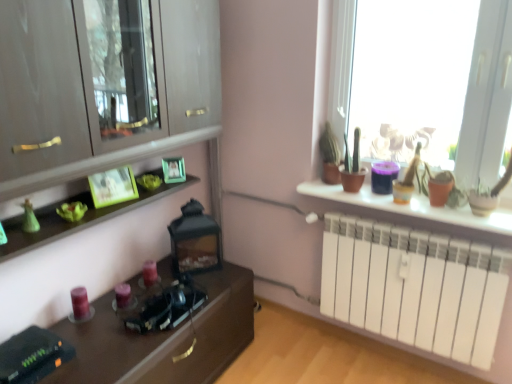
Question: Could matte green picture frame at center, the first picture frame in the back-to-front sequence, be considered to be inside matte white radiator at right?

Choices:
 (A) yes
 (B) no

Answer: (B)

Question: From the image's perspective, is matte white radiator at right located beneath matte green picture frame at center, the first picture frame in the back-to-front sequence?

Choices:
 (A) yes
 (B) no

Answer: (A)

Question: Considering the relative positions of matte white radiator at right and matte green picture frame at center, the first picture frame in the back-to-front sequence, in the image provided, is matte white radiator at right to the left of matte green picture frame at center, the first picture frame in the back-to-front sequence, from the viewer's perspective?

Choices:
 (A) no
 (B) yes

Answer: (A)

Question: From the image's perspective, is matte white radiator at right above matte green picture frame at center, the first picture frame positioned from the right?

Choices:
 (A) yes
 (B) no

Answer: (B)

Question: Is matte white radiator at right at the right side of matte green picture frame at center, the first picture frame in the back-to-front sequence?

Choices:
 (A) yes
 (B) no

Answer: (A)

Question: From their relative heights in the image, would you say matte purple candle at lower left, which is counted as the 1th candle, starting from the right, is taller or shorter than matte purple candle at lower left, which is the second candle from right to left?

Choices:
 (A) tall
 (B) short

Answer: (B)

Question: Considering the positions of matte purple candle at lower left, which is the 2th candle from left to right, and matte purple candle at lower left, which is the first candle from left to right, in the image, is matte purple candle at lower left, which is the 2th candle from left to right, wider or thinner than matte purple candle at lower left, which is the first candle from left to right,?

Choices:
 (A) thin
 (B) wide

Answer: (A)

Question: Is matte purple candle at lower left, which is the 2th candle from left to right, to the left or to the right of matte purple candle at lower left, which is the second candle from right to left, in the image?

Choices:
 (A) right
 (B) left

Answer: (A)

Question: Is matte purple candle at lower left, which is the 2th candle from left to right, in front of or behind matte purple candle at lower left, which is the second candle from right to left, in the image?

Choices:
 (A) front
 (B) behind

Answer: (B)

Question: From the image's perspective, relative to matte purple candle at lower left, which is the second candle from right to left, is green matte picture frame at upper left, acting as the second picture frame starting from the back, above or below?

Choices:
 (A) below
 (B) above

Answer: (B)

Question: Relative to matte purple candle at lower left, which is the first candle from left to right, is green matte picture frame at upper left, acting as the second picture frame starting from the back, in front or behind?

Choices:
 (A) behind
 (B) front

Answer: (B)

Question: From their relative heights in the image, would you say green matte picture frame at upper left, which appears as the first picture frame when viewed from the front, is taller or shorter than matte purple candle at lower left, which is the first candle from left to right?

Choices:
 (A) tall
 (B) short

Answer: (A)

Question: Is green matte picture frame at upper left, acting as the second picture frame starting from the back, inside or outside of matte purple candle at lower left, which is the first candle from left to right?

Choices:
 (A) inside
 (B) outside

Answer: (B)

Question: Considering the positions of matte green picture frame at center, the first picture frame positioned from the right, and translucent glass window at upper right in the image, is matte green picture frame at center, the first picture frame positioned from the right, wider or thinner than translucent glass window at upper right?

Choices:
 (A) wide
 (B) thin

Answer: (B)

Question: Is matte green picture frame at center, the first picture frame in the back-to-front sequence, inside or outside of translucent glass window at upper right?

Choices:
 (A) outside
 (B) inside

Answer: (A)